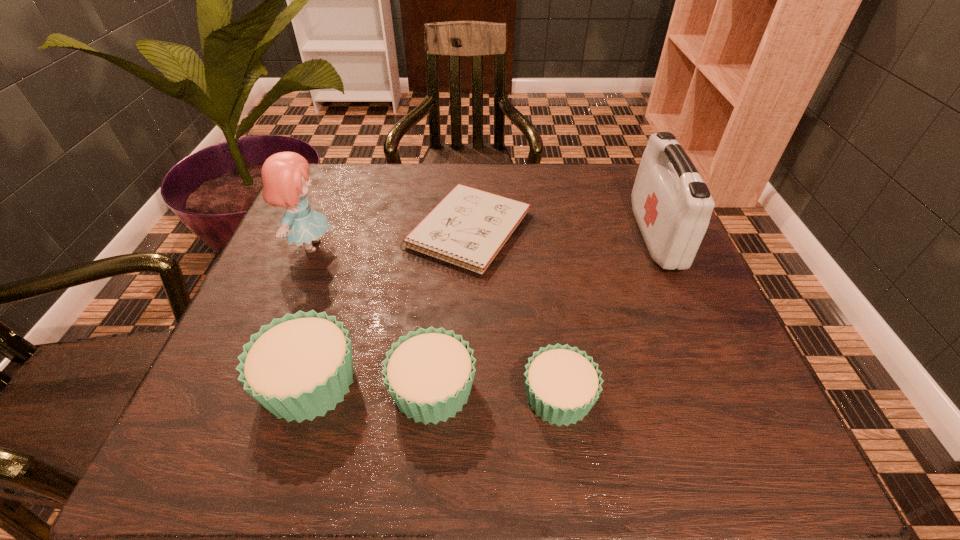
Find the location of a particular element. Image resolution: width=960 pixels, height=540 pixels. object that can be found as the fifth closest to the shortest object is located at coordinates (672, 205).

Locate an element on the screen. cupcake that is the second closest to the second shortest cupcake is located at coordinates (562, 383).

Select which cupcake is the second closest to the leftmost cupcake. Please provide its 2D coordinates. Your answer should be formatted as a tuple, i.e. [(x, y)], where the tuple contains the x and y coordinates of a point satisfying the conditions above.

[(562, 383)]

Find the location of a particular element. The height and width of the screenshot is (540, 960). free spot that satisfies the following two spatial constraints: 1. on the front-facing side of the doll; 2. on the right side of the second cupcake from right to left is located at coordinates (252, 389).

Locate an element on the screen. blank space that satisfies the following two spatial constraints: 1. on the front-facing side of the doll; 2. on the left side of the second cupcake from left to right is located at coordinates (252, 389).

You are a GUI agent. You are given a task and a screenshot of the screen. Output one action in this format:
    pyautogui.click(x=<x>, y=<y>)
    Task: Click on the free space that satisfies the following two spatial constraints: 1. on the front-facing side of the doll; 2. on the left side of the leftmost cupcake
    The width and height of the screenshot is (960, 540).
    Given the screenshot: What is the action you would take?
    pyautogui.click(x=255, y=382)

Find the location of `vacant space that satisfies the following two spatial constraints: 1. on the front side of the second shortest cupcake; 2. on the left side of the leftmost cupcake`. vacant space that satisfies the following two spatial constraints: 1. on the front side of the second shortest cupcake; 2. on the left side of the leftmost cupcake is located at coordinates (307, 389).

Identify the location of free space that satisfies the following two spatial constraints: 1. on the front-facing side of the doll; 2. on the right side of the leftmost cupcake. The image size is (960, 540). (255, 382).

Locate an element on the screen. Image resolution: width=960 pixels, height=540 pixels. free region that satisfies the following two spatial constraints: 1. on the front-facing side of the shortest cupcake; 2. on the left side of the doll is located at coordinates (250, 396).

Find the location of a particular element. This screenshot has width=960, height=540. vacant space that satisfies the following two spatial constraints: 1. on the front side of the shortest object; 2. on the front-facing side of the doll is located at coordinates (468, 246).